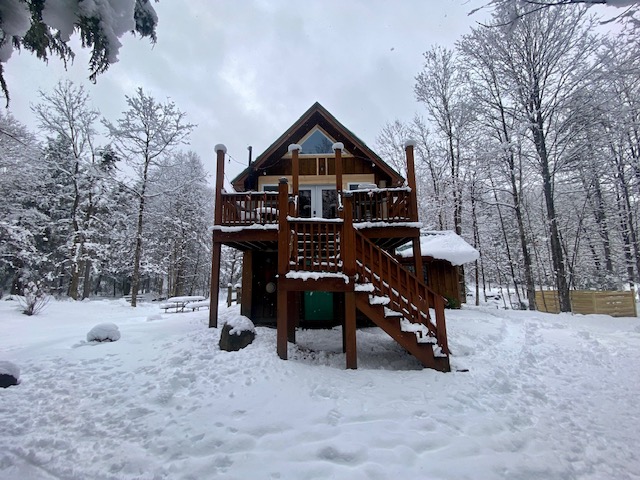
The height and width of the screenshot is (480, 640). In order to click on stairs in this screenshot , I will do `click(358, 259)`.